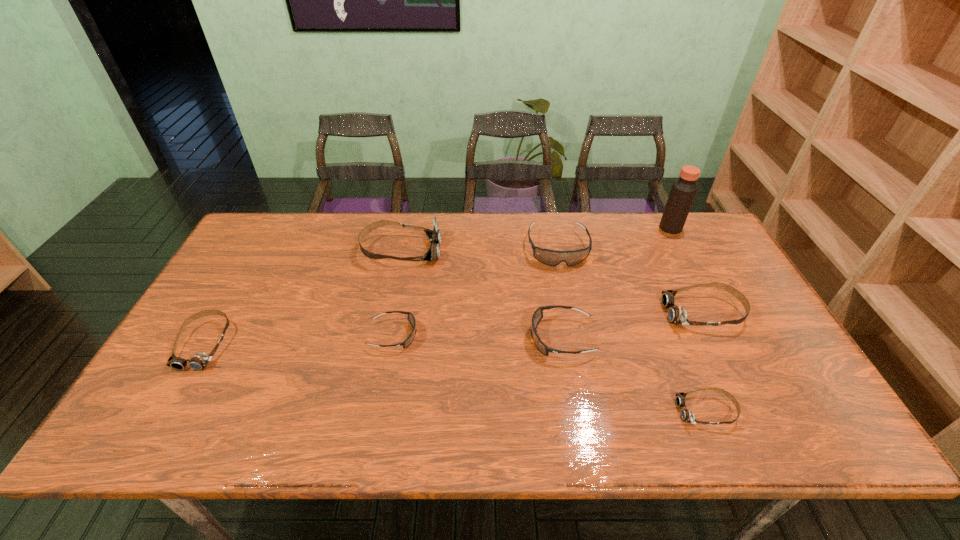
This screenshot has width=960, height=540. Identify the location of the nearest object. (686, 415).

The image size is (960, 540). I want to click on the nearest brown goggles, so click(686, 415).

Locate an element on the screen. free space located 0.070m on the right of the tallest object is located at coordinates (702, 228).

Where is `free space located on the front-facing side of the farthest brown goggles`? The image size is (960, 540). free space located on the front-facing side of the farthest brown goggles is located at coordinates (561, 250).

You are a GUI agent. You are given a task and a screenshot of the screen. Output one action in this format:
    pyautogui.click(x=<x>, y=<y>)
    Task: Click on the vacant point located on the lenses of the farthest black goggles
    
    Given the screenshot: What is the action you would take?
    pyautogui.click(x=571, y=313)

Image resolution: width=960 pixels, height=540 pixels. In order to click on vacant space located 0.200m on the front-facing side of the third smallest brown goggles in this screenshot , I will do `click(593, 313)`.

Where is `vacant space located on the front-facing side of the third smallest brown goggles`? vacant space located on the front-facing side of the third smallest brown goggles is located at coordinates (589, 313).

The height and width of the screenshot is (540, 960). Find the location of `vacant region located 0.370m on the front-facing side of the third smallest brown goggles`. vacant region located 0.370m on the front-facing side of the third smallest brown goggles is located at coordinates (532, 313).

The width and height of the screenshot is (960, 540). Identify the location of vacant space positioned 0.270m on the lenses of the second biggest black goggles. coord(427,338).

This screenshot has width=960, height=540. What are the coordinates of `free space located 0.200m on the lenses of the second biggest black goggles` in the screenshot? It's located at (454, 338).